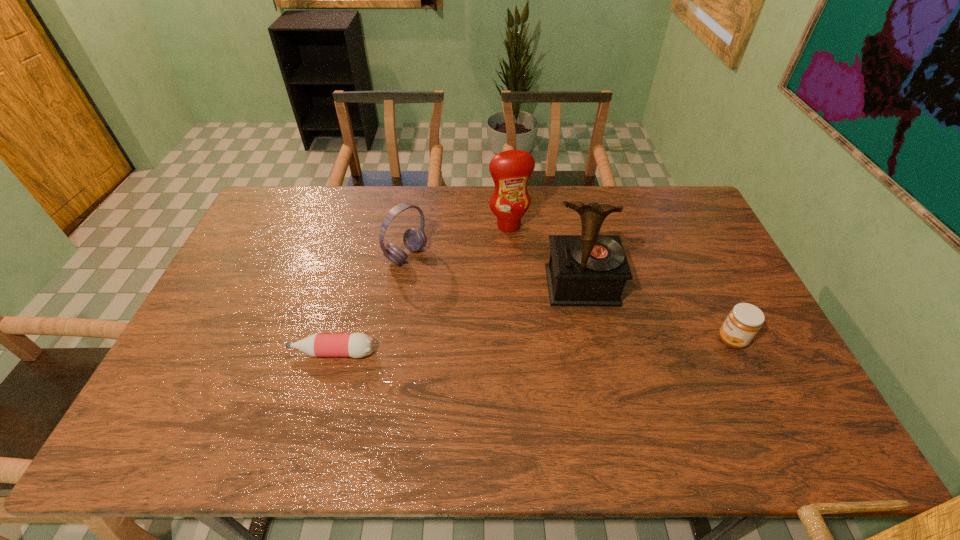
You are a GUI agent. You are given a task and a screenshot of the screen. Output one action in this format:
    pyautogui.click(x=<x>, y=<y>)
    Task: Click on the vacant spot on the desktop that is between the shortest object and the fourth tallest object and is positioned on the label side of the third object from left to right
    This screenshot has height=540, width=960.
    Given the screenshot: What is the action you would take?
    pyautogui.click(x=552, y=346)

The image size is (960, 540). Find the location of `free space on the desktop that is between the shortest object and the fourth tallest object and is positioned on the headband and ear cups of the headset`. free space on the desktop that is between the shortest object and the fourth tallest object and is positioned on the headband and ear cups of the headset is located at coordinates (551, 346).

Where is `free spot on the desktop that is between the bottle and the jam and is positioned at the horn opening of the fourth object from left to right`? free spot on the desktop that is between the bottle and the jam and is positioned at the horn opening of the fourth object from left to right is located at coordinates (593, 344).